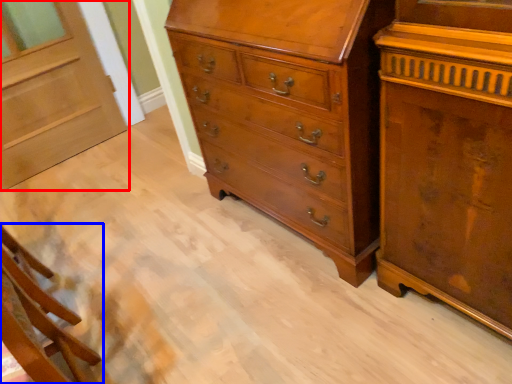
Question: Which object is closer to the camera taking this photo, door (highlighted by a red box) or furniture (highlighted by a blue box)?

Choices:
 (A) door
 (B) furniture

Answer: (B)